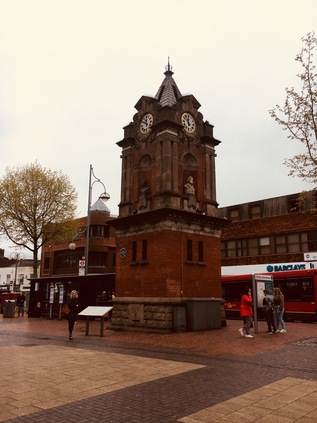
Locate an element on the screen. statue is located at coordinates pos(190,186), pos(142,191).